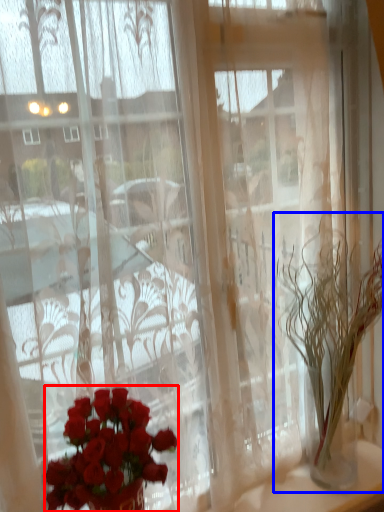
Question: Which of the following is the farthest to the observer, flower (highlighted by a red box) or houseplant (highlighted by a blue box)?

Choices:
 (A) flower
 (B) houseplant

Answer: (B)